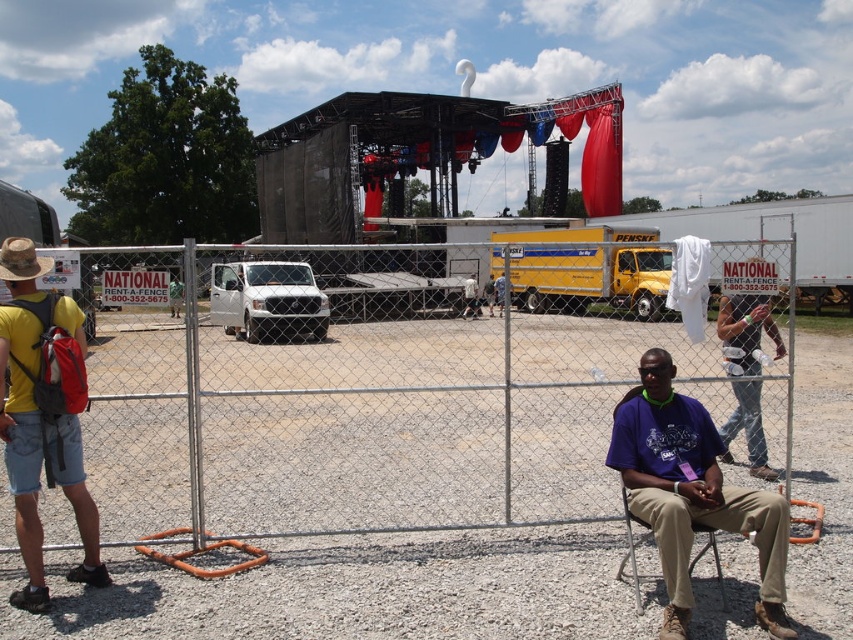
Question: Which is nearer to the purple cotton shirt at center?

Choices:
 (A) metal chain-link fence at center
 (B) red backpack at left

Answer: (B)

Question: Considering the relative positions of purple cotton shirt at center and denim jeans at right in the image provided, where is purple cotton shirt at center located with respect to denim jeans at right?

Choices:
 (A) right
 (B) left

Answer: (B)

Question: Is purple cotton shirt at center above brown felt cowboy hat at left?

Choices:
 (A) yes
 (B) no

Answer: (B)

Question: Does purple cotton shirt at center appear over brown felt cowboy hat at left?

Choices:
 (A) yes
 (B) no

Answer: (B)

Question: Which point appears farthest from the camera in this image?

Choices:
 (A) (15, 257)
 (B) (662, 444)
 (C) (97, 579)

Answer: (C)

Question: Which point appears farthest from the camera in this image?

Choices:
 (A) (759, 476)
 (B) (627, 506)
 (C) (735, 525)

Answer: (A)